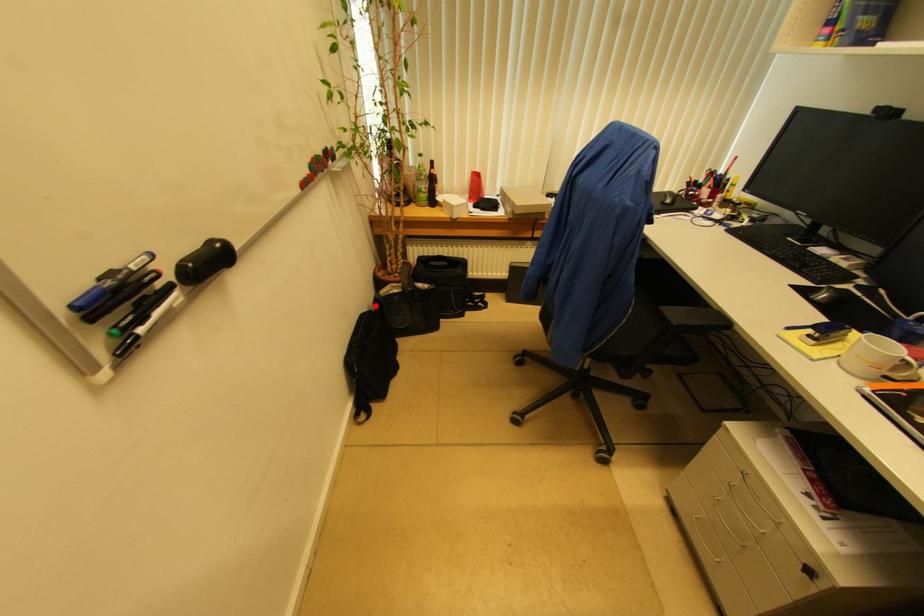
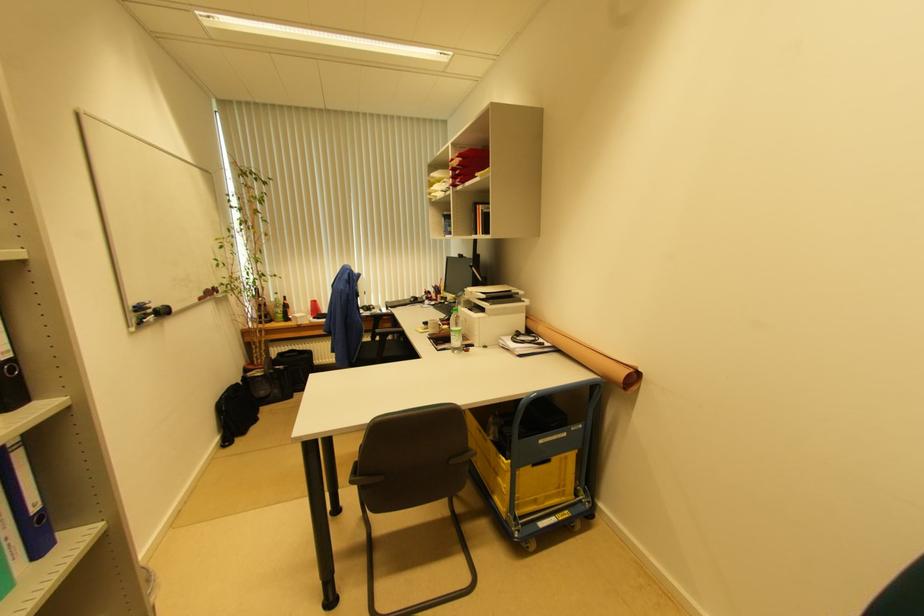
Question: I am providing you with two images of the same scene from different viewpoints. Image1 has a red point marked. In image2, the corresponding 3D location appears at what relative position? Reply with the corresponding letter.

Choices:
 (A) Closer
 (B) Farther

Answer: (B)